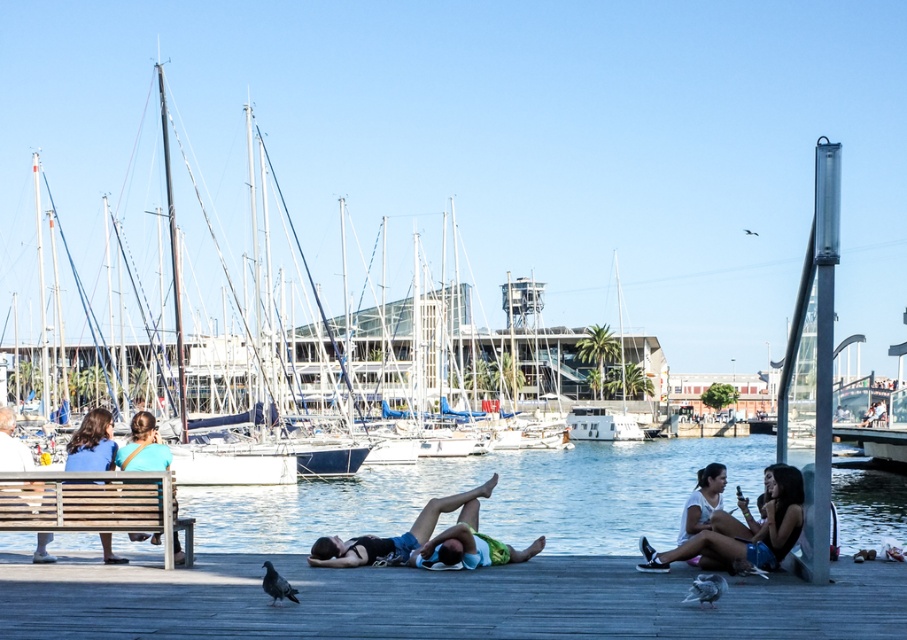
How far apart are green fabric shorts at center and white cotton dress at lower right?

green fabric shorts at center and white cotton dress at lower right are 3.98 meters apart from each other.

Where is `green fabric shorts at center`? Image resolution: width=907 pixels, height=640 pixels. green fabric shorts at center is located at coordinates (470, 538).

Looking at this image, does white sailboat at left come behind green fabric shorts at center?

Yes, it is.

Can you confirm if white sailboat at left is shorter than green fabric shorts at center?

Incorrect, white sailboat at left's height does not fall short of green fabric shorts at center's.

Does point (444, 218) lie behind point (418, 548)?

Yes.

The image size is (907, 640). I want to click on white sailboat at left, so click(x=215, y=355).

Does clear blue water at center appear on the right side of dark blue fabric at center?

Correct, you'll find clear blue water at center to the right of dark blue fabric at center.

Which is in front, point (502, 464) or point (315, 545)?

Point (315, 545) is in front.

Locate an element on the screen. The height and width of the screenshot is (640, 907). clear blue water at center is located at coordinates (490, 497).